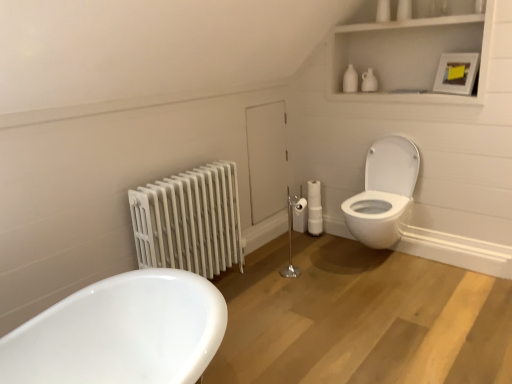
Question: From the image's perspective, is white glossy toilet at right positioned above or below white matte cabinet at upper right?

Choices:
 (A) below
 (B) above

Answer: (A)

Question: Considering the positions of point (404, 201) and point (359, 26), is point (404, 201) closer or farther from the camera than point (359, 26)?

Choices:
 (A) closer
 (B) farther

Answer: (A)

Question: Which of these objects is positioned farthest from the white painted metal radiator at left?

Choices:
 (A) white glossy toilet at right
 (B) white matte cabinet at upper right
 (C) silver metallic toilet paper holder at center

Answer: (B)

Question: Which of these objects is positioned farthest from the white glossy toilet at right?

Choices:
 (A) white matte cabinet at upper right
 (B) white painted metal radiator at left
 (C) silver metallic toilet paper holder at center

Answer: (B)